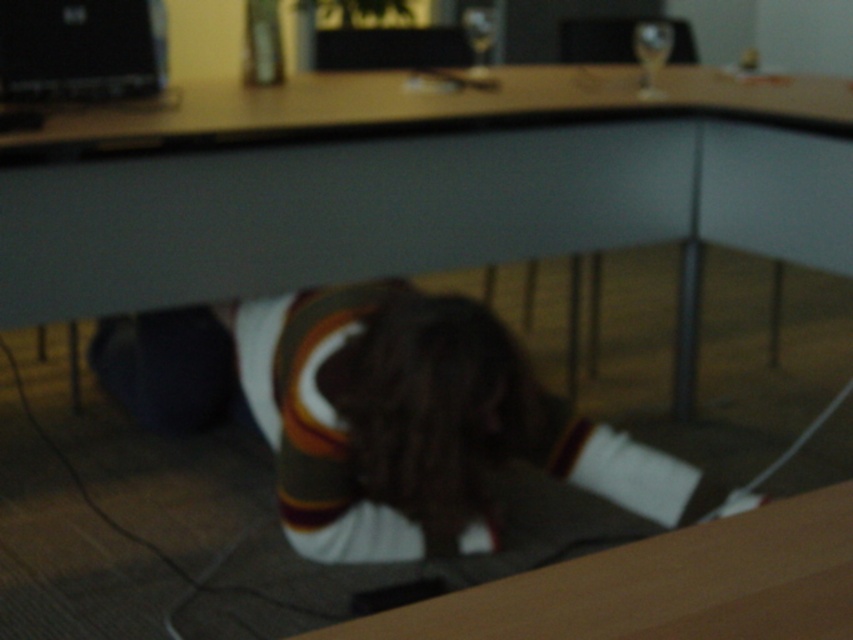
Question: Among these objects, which one is farthest from the camera?

Choices:
 (A) black matte laptop at upper left
 (B) smooth wood computer desk at center

Answer: (A)

Question: Does smooth wood computer desk at center come behind black matte laptop at upper left?

Choices:
 (A) no
 (B) yes

Answer: (A)

Question: Is smooth wood computer desk at center to the right of brown jersey at center from the viewer's perspective?

Choices:
 (A) no
 (B) yes

Answer: (B)

Question: Which point is closer to the camera?

Choices:
 (A) smooth wood computer desk at center
 (B) black matte laptop at upper left
 (C) brown jersey at center

Answer: (C)

Question: Is smooth wood computer desk at center to the right of brown jersey at center from the viewer's perspective?

Choices:
 (A) no
 (B) yes

Answer: (B)

Question: Which point is farther from the camera taking this photo?

Choices:
 (A) pyautogui.click(x=262, y=356)
 (B) pyautogui.click(x=698, y=234)

Answer: (B)